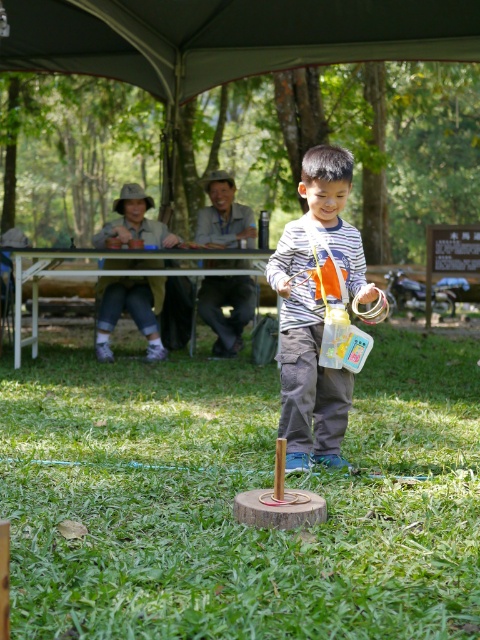
You are planning to set up a small tent under the dark gray fabric canopy at upper center and the white plastic picnic table at upper center. Which structure has a larger horizontal space to accommodate the tent?

The dark gray fabric canopy at upper center might be wider than the white plastic picnic table at upper center, so it has a larger horizontal space to accommodate the tent.

You are standing at the origin point of the image coordinate system. You want to walk to the green grass at center. According to the coordinate system, in which direction should you move?

The green grass at center is located at coordinate point (237, 492). Since the origin is at the bottom left corner of the image, moving towards higher x and y coordinates would mean moving to the right and upwards respectively. Therefore, to reach the green grass at center, you should move to the right and slightly upwards from your current position at the origin.

You are a visitor at the park and want to sit under the dark gray fabric canopy at upper center. However, there is a white plastic picnic table at upper center in the way. Can you walk directly to the canopy without moving the table?

The dark gray fabric canopy at upper center is to the right of the white plastic picnic table at upper center, so you can walk around the table to reach the canopy since they are positioned side by side.